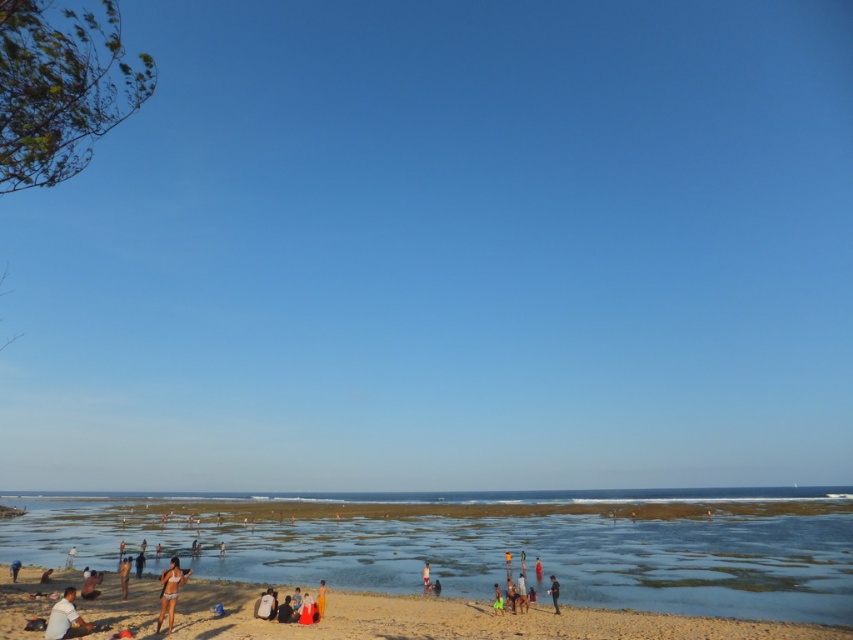
You are standing at the point marked as point (x=490, y=548) in the image. Looking towards the clear water at lower left, which direction should you walk to reach the ocean?

The point (x=490, y=548) marks clear water at lower left, so you are already at the ocean.

You are standing at point A and want to walk to point B. The coordinates for point A are point [759,552] and point B are point [158,628]. According to the scene, which direction should you face to walk towards point B from point A?

Since point [759,552] is behind point [158,628], you should face towards the direction of point B, which is in front of point A. Therefore, you should face forward towards point [158,628].